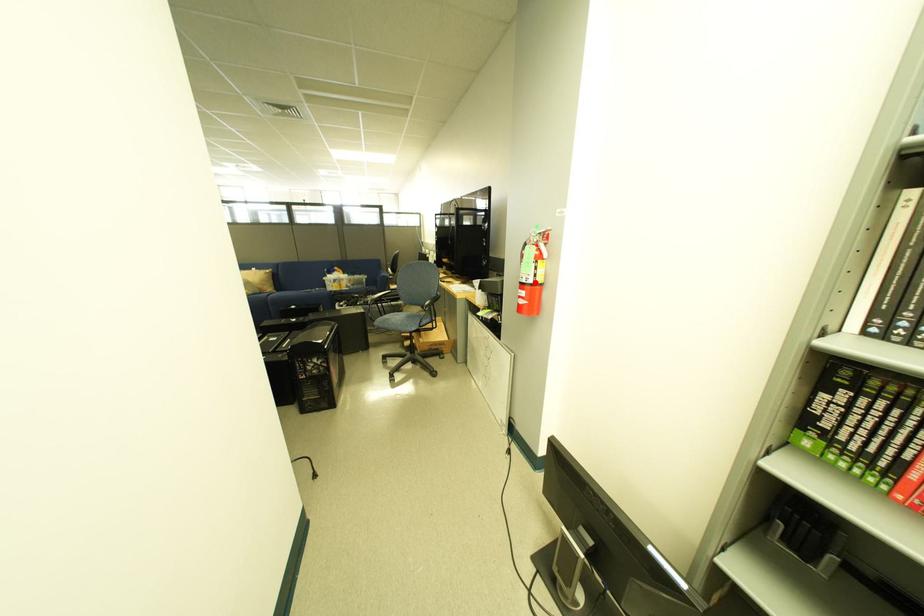
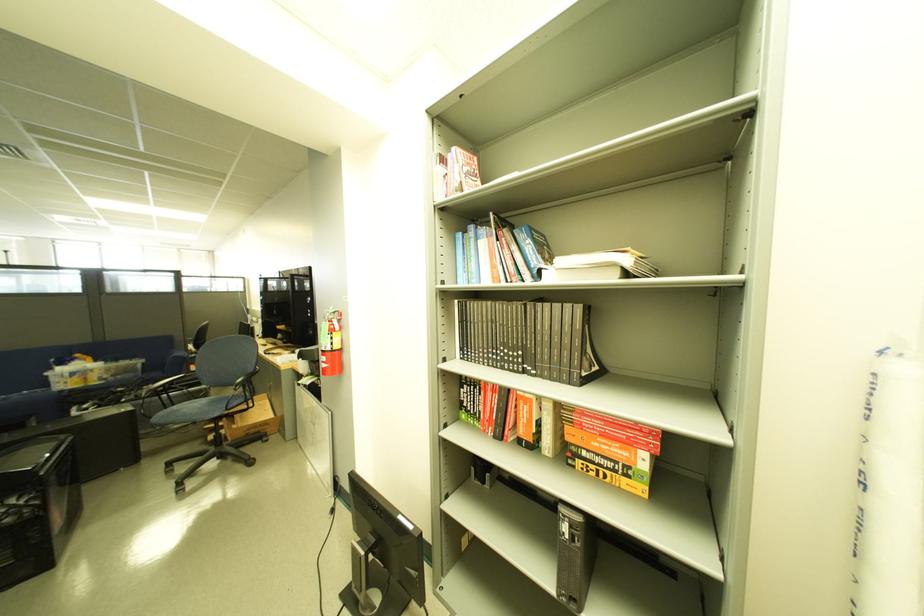
Find the pixel in the second image that matches the highlighted location in the first image.

(334, 351)